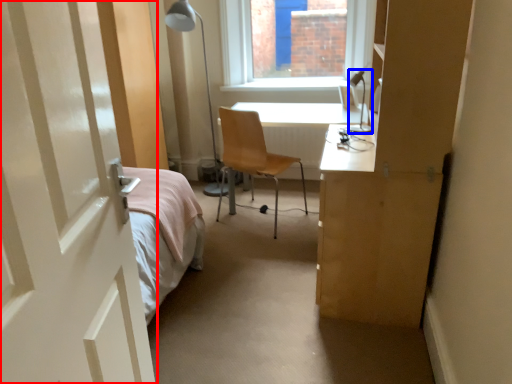
Question: Which object is closer to the camera taking this photo, door (highlighted by a red box) or table lamp (highlighted by a blue box)?

Choices:
 (A) door
 (B) table lamp

Answer: (A)